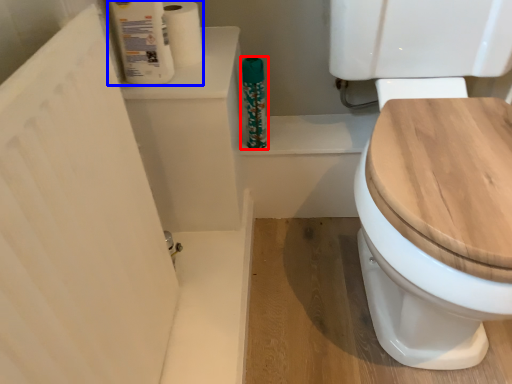
Question: Which object appears farthest to the camera in this image, cleaning product (highlighted by a red box) or toilet paper (highlighted by a blue box)?

Choices:
 (A) cleaning product
 (B) toilet paper

Answer: (A)